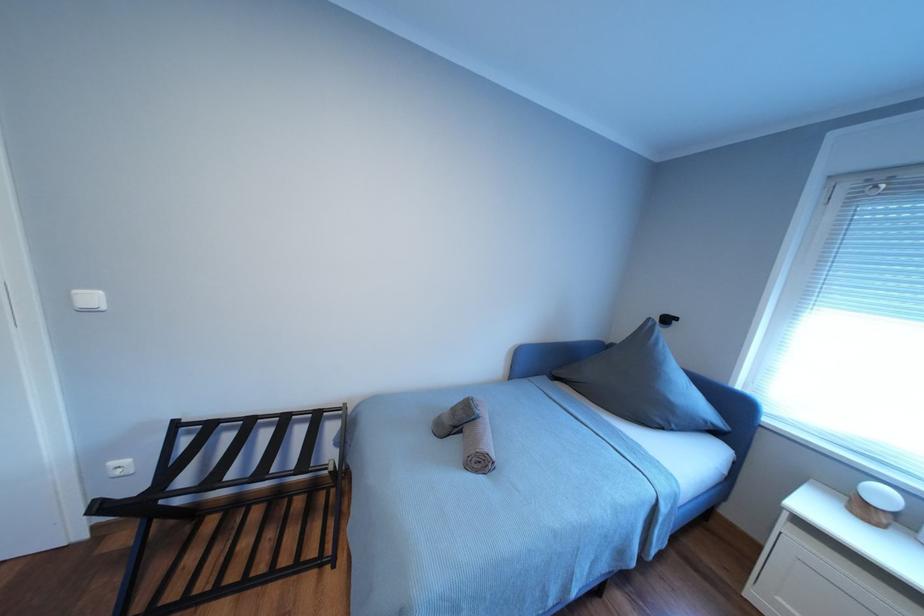
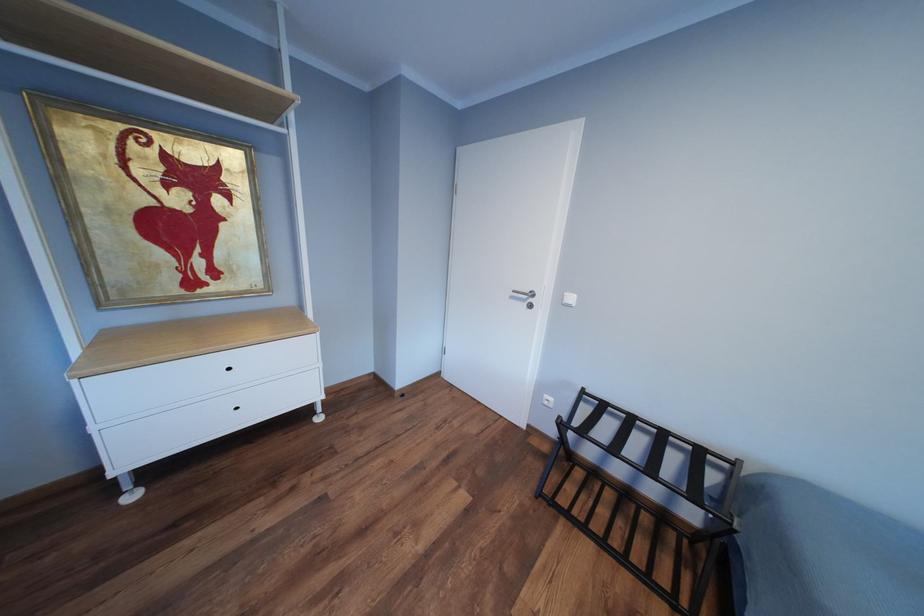
Question: How did the camera likely rotate?

Choices:
 (A) Left
 (B) Right
 (C) Up
 (D) Down

Answer: (A)